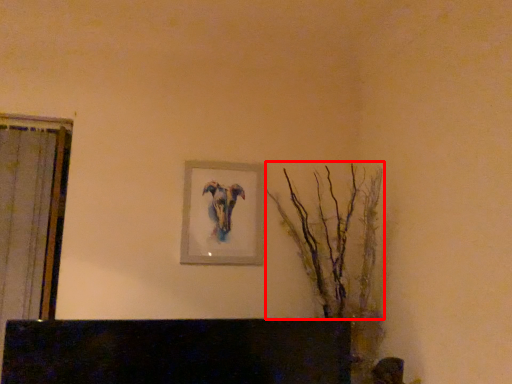
Question: From the image's perspective, considering the relative positions of tree (annotated by the red box) and picture frame in the image provided, where is tree (annotated by the red box) located with respect to the staircase?

Choices:
 (A) below
 (B) above

Answer: (A)